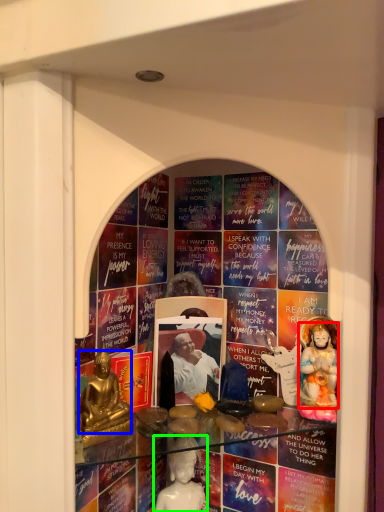
Question: Based on their relative distances, which object is nearer to person (highlighted by a red box)? Choose from person (highlighted by a blue box) and person (highlighted by a green box).

Choices:
 (A) person
 (B) person

Answer: (B)